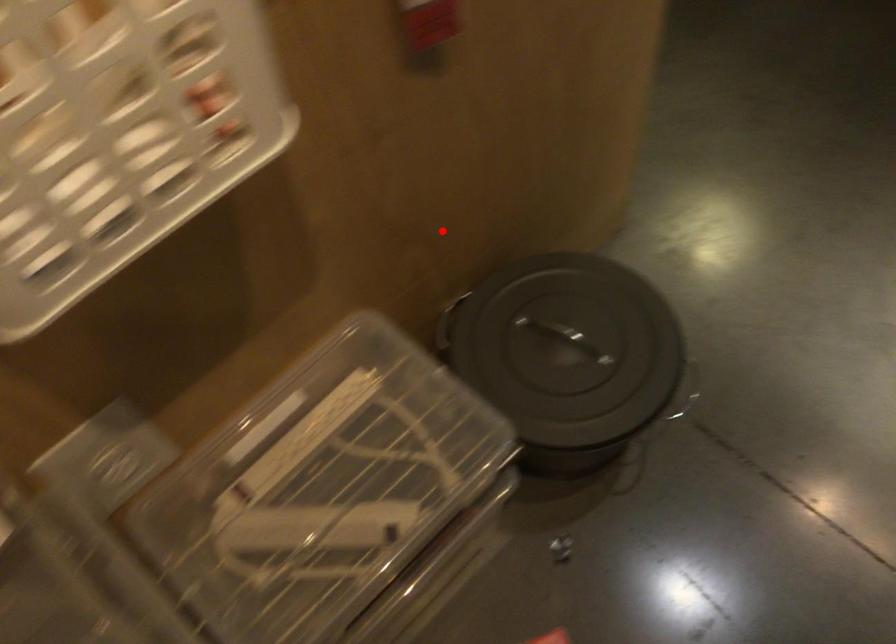
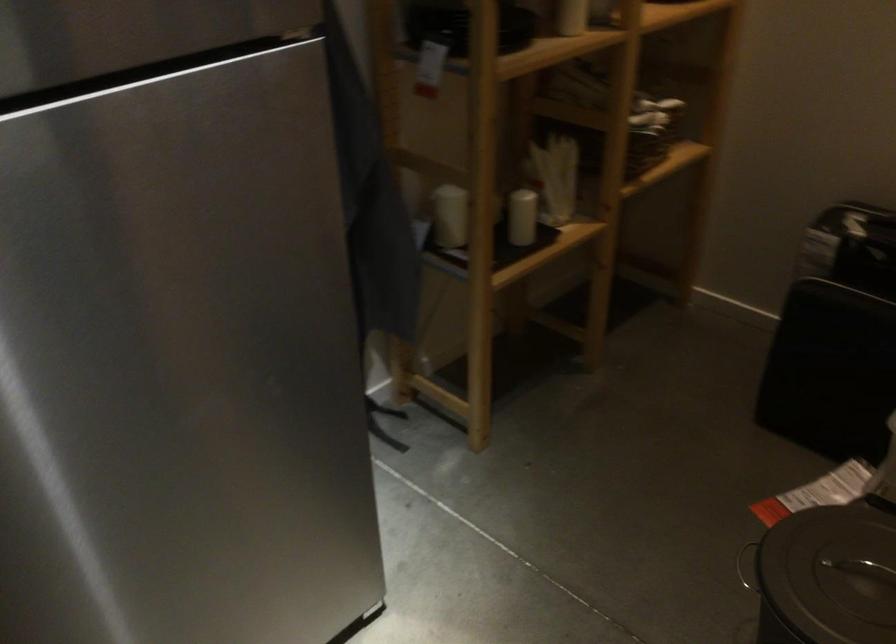
Where in the second image is the point corresponding to the highlighted location from the first image?

(828, 576)